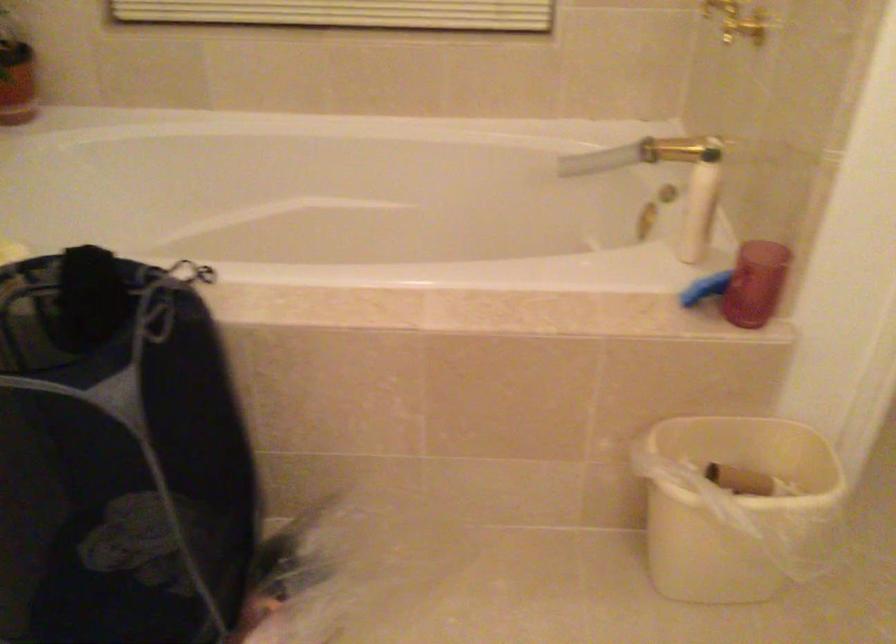
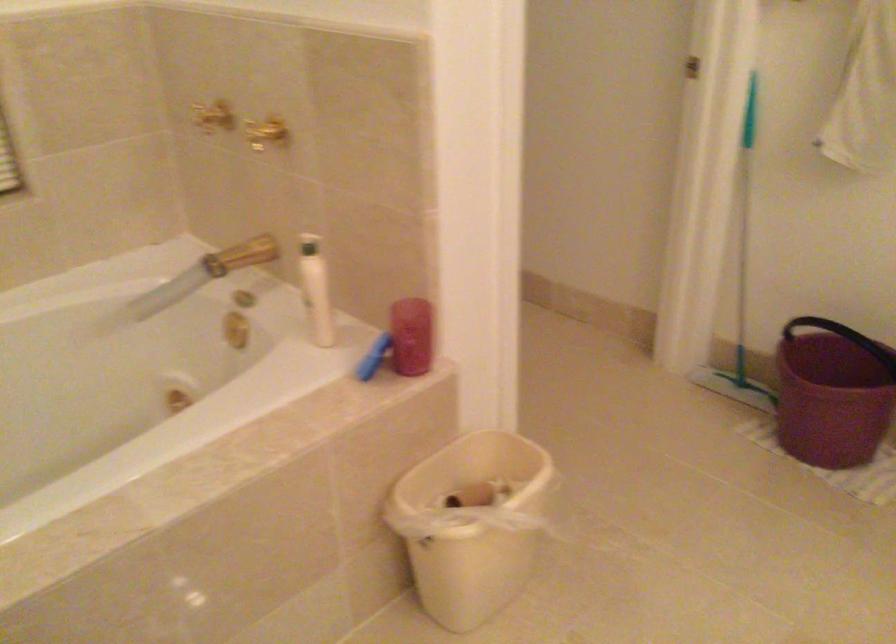
Locate, in the second image, the point that corresponds to [695,200] in the first image.

(315, 289)